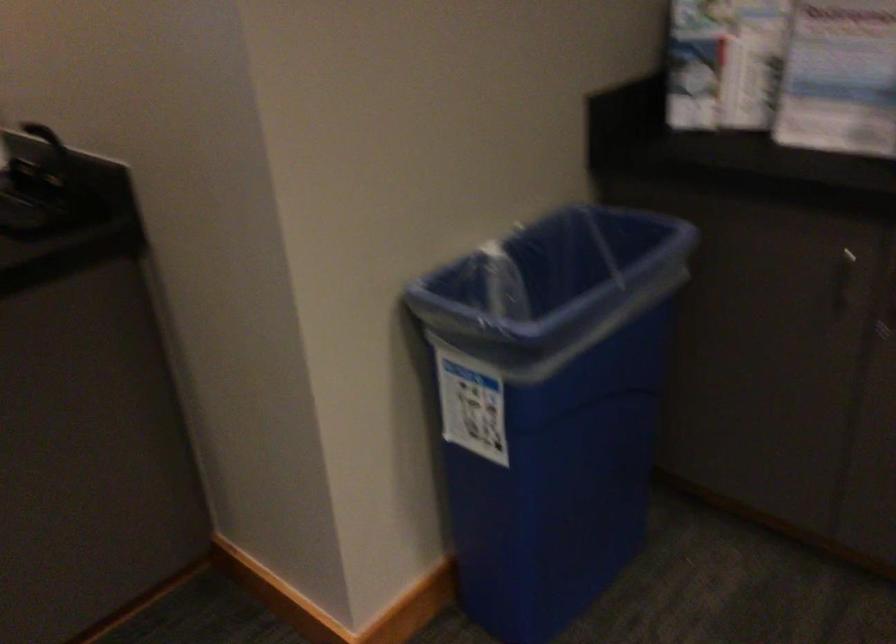
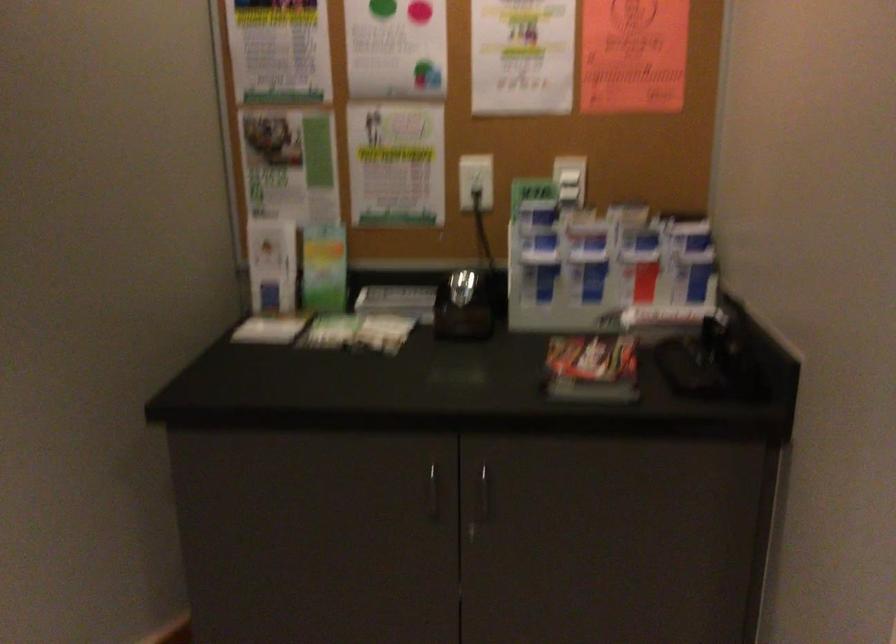
Question: The camera is either moving clockwise (left) or counter-clockwise (right) around the object. The first image is from the beginning of the video and the second image is from the end. Is the camera moving left or right when shooting the video?

Choices:
 (A) Left
 (B) Right

Answer: (B)